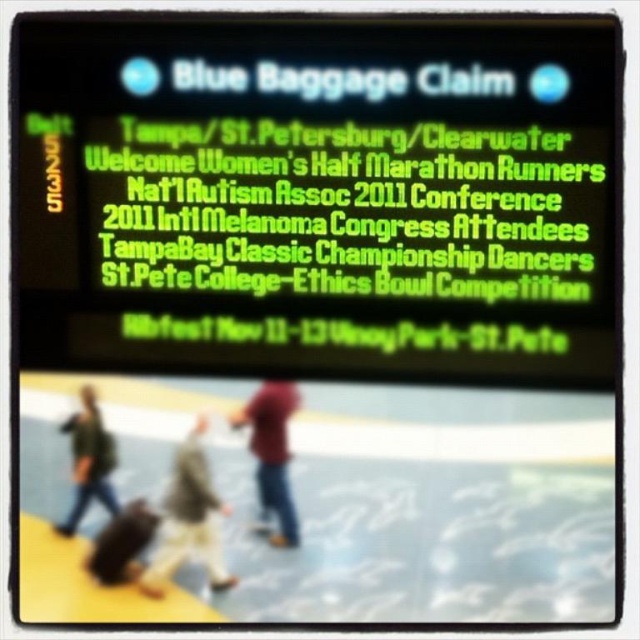
Question: Based on their relative distances, which object is farther from the green neon sign at upper center?

Choices:
 (A) green fabric jacket at lower left
 (B) light beige fabric jacket at center
 (C) red matte shirt at center

Answer: (A)

Question: Observing the image, what is the correct spatial positioning of light beige fabric jacket at center in reference to green fabric jacket at lower left?

Choices:
 (A) left
 (B) right

Answer: (B)

Question: Among these points, which one is nearest to the camera?

Choices:
 (A) (80, 456)
 (B) (200, 556)

Answer: (A)

Question: Which object is the closest to the green fabric jacket at lower left?

Choices:
 (A) green neon sign at upper center
 (B) light beige fabric jacket at center
 (C) red matte shirt at center

Answer: (B)

Question: Can you confirm if green neon sign at upper center is wider than green fabric jacket at lower left?

Choices:
 (A) no
 (B) yes

Answer: (B)

Question: Does red matte shirt at center appear over green fabric jacket at lower left?

Choices:
 (A) yes
 (B) no

Answer: (B)